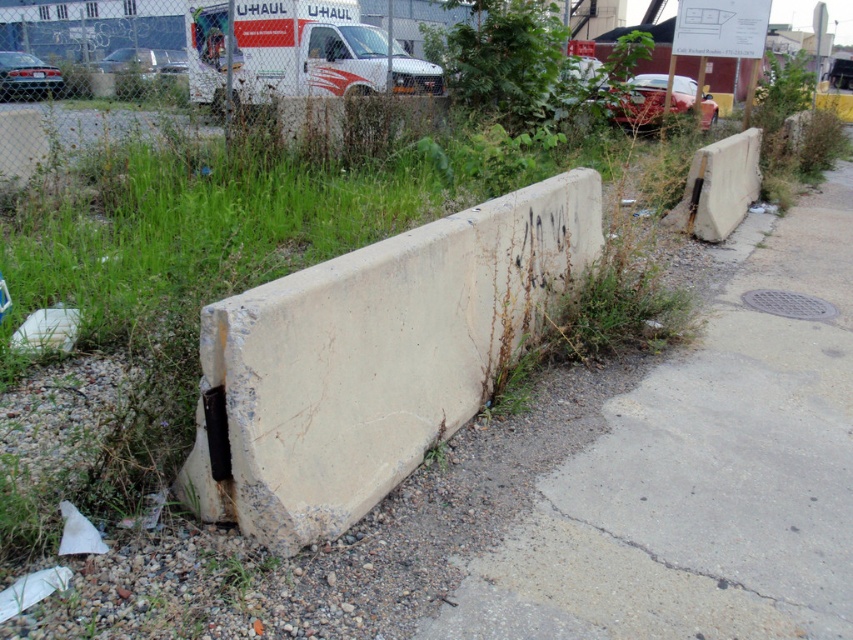
You are a delivery driver who needs to park your truck near the white matte van at upper center. However, there is a concrete pavement at lower right in the way. Can you drive around it to the left or right?

The concrete pavement at lower right is positioned on the right side of the white matte van at upper center, so you can drive around to the left side of the concrete pavement at lower right to reach the white matte van at upper center.

You are a delivery driver who needs to park your truck behind the white concrete barrier at center and the white matte van at upper center. Given their sizes, which one can you park closer to without worrying about blocking the other?

The white concrete barrier at center has a smaller size compared to white matte van at upper center, so you can park closer to the white concrete barrier at center without blocking the van.

You are standing at the point marked by the coordinates point (703, 476). What is the surface you are standing on?

The surface at point (703, 476) is the concrete pavement at lower right.